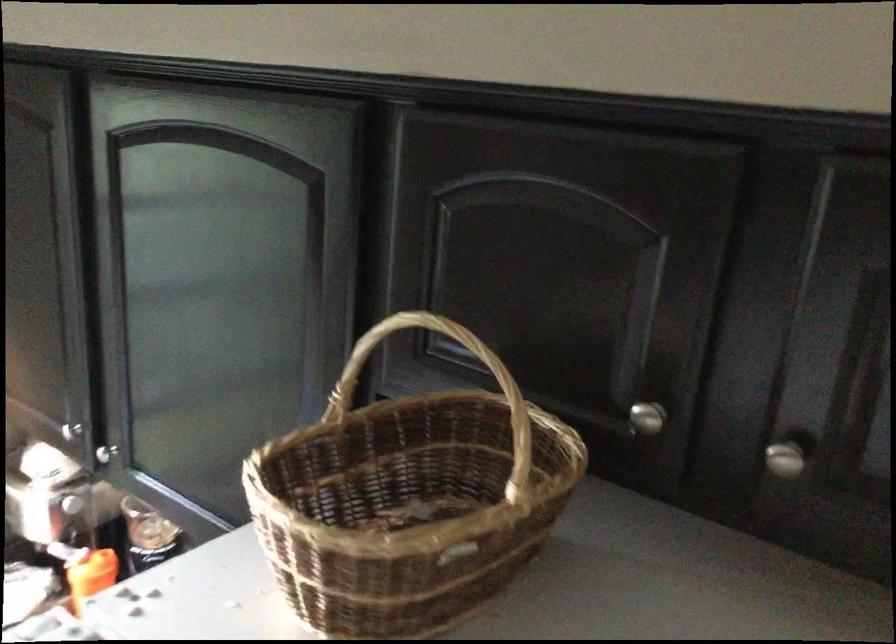
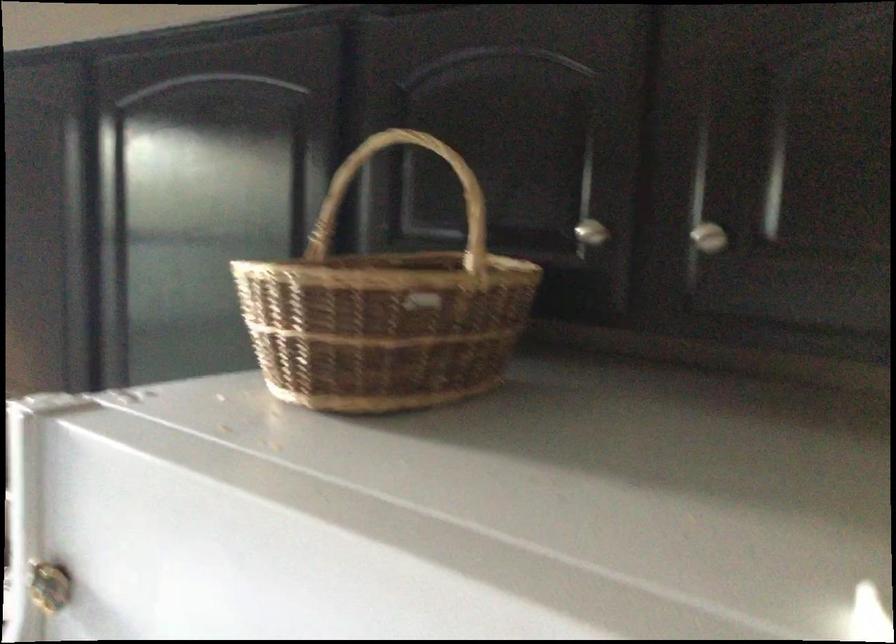
Where in the second image is the point corresponding to point 650,424 from the first image?

(590, 232)